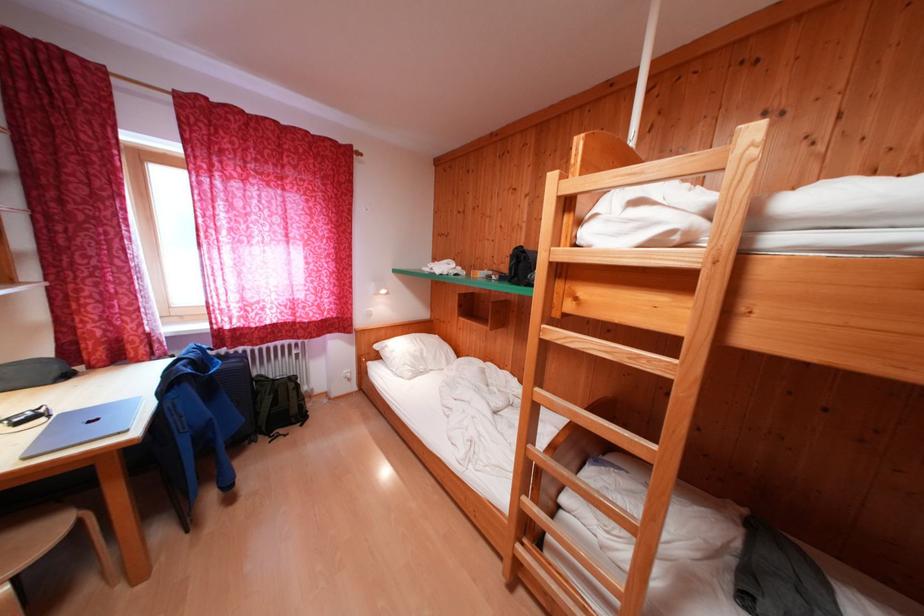
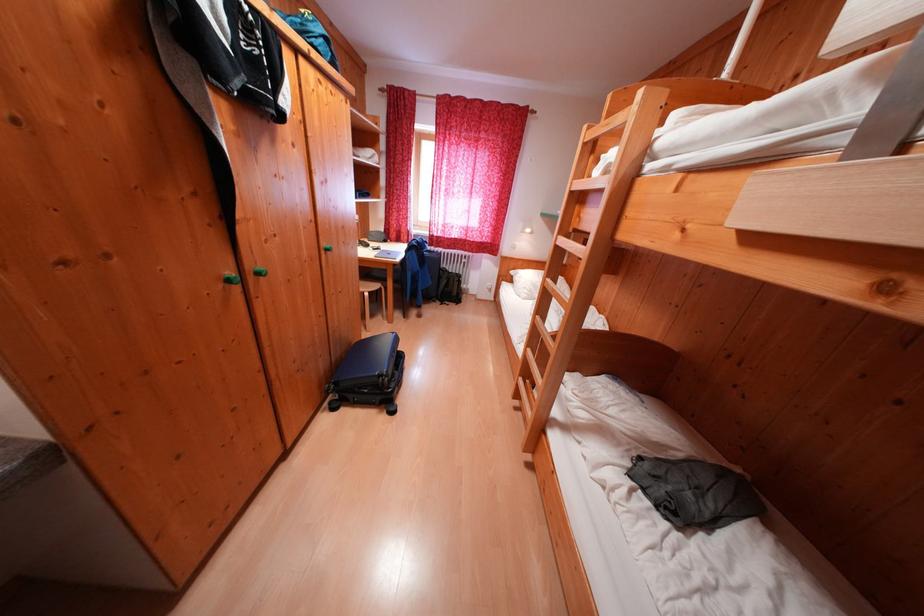
Locate, in the second image, the point that corresponds to point (55, 538) in the first image.

(383, 290)